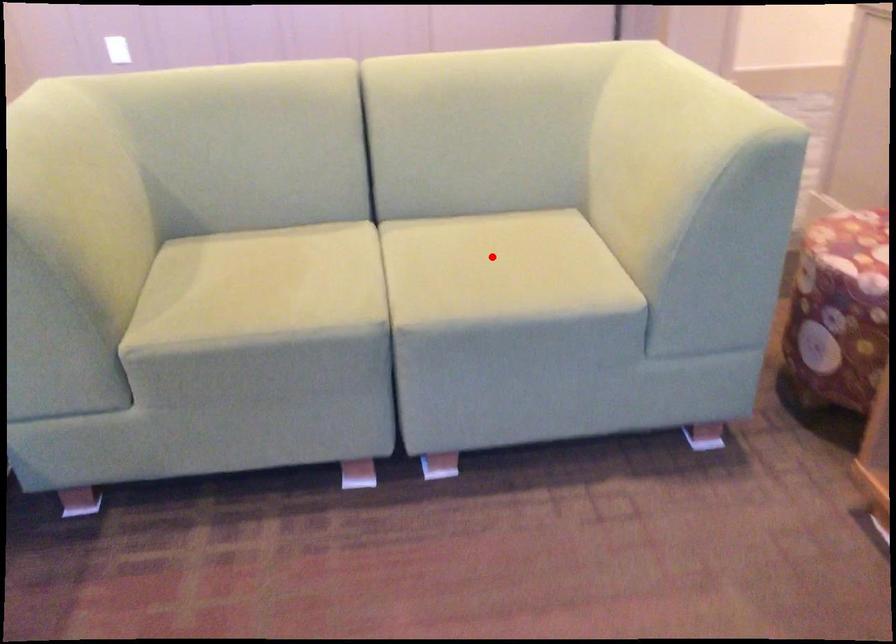
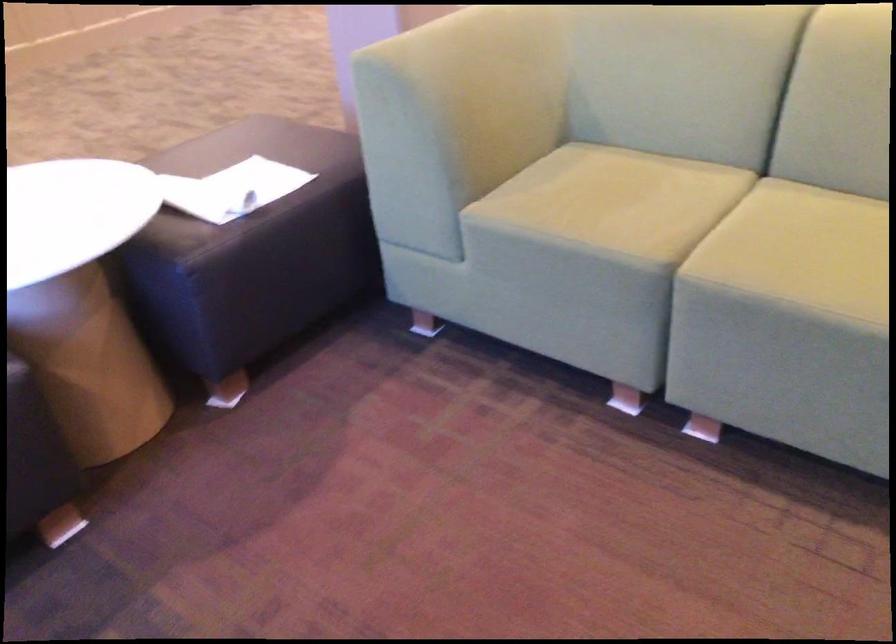
Locate, in the second image, the point that corresponds to the highlighted location in the first image.

(837, 238)